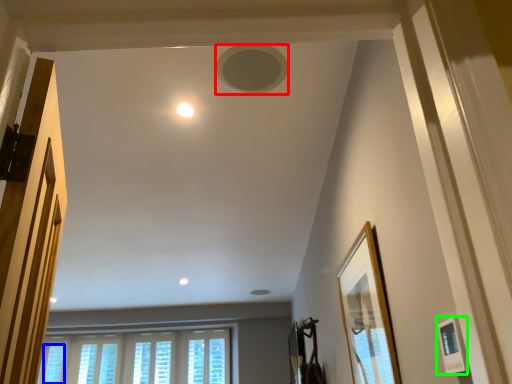
Question: Which object is positioned farthest from hole (highlighted by a red box)? Select from window (highlighted by a blue box) and picture frame (highlighted by a green box).

Choices:
 (A) window
 (B) picture frame

Answer: (A)